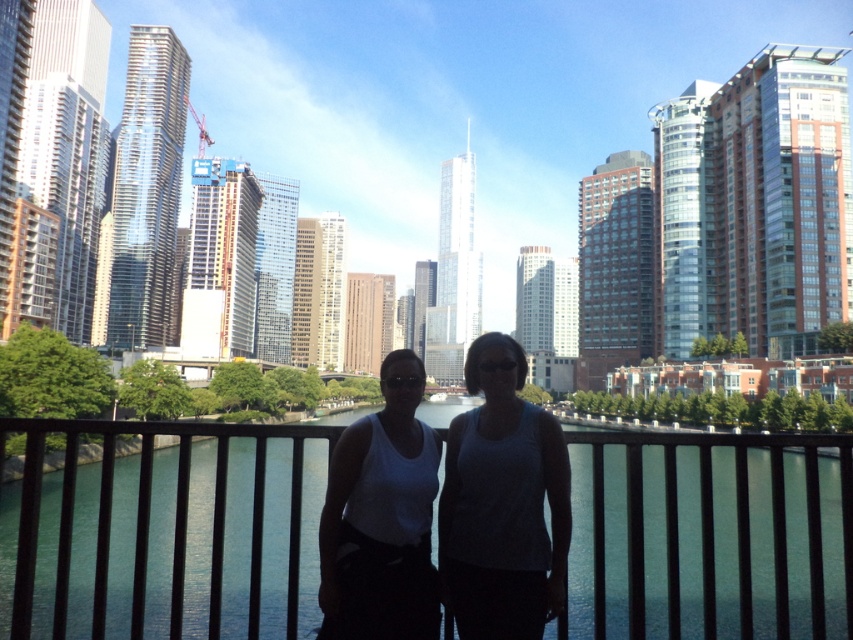
Is white fabric tank top at center wider than white matte tank top at center?

Yes.

You are a GUI agent. You are given a task and a screenshot of the screen. Output one action in this format:
    pyautogui.click(x=<x>, y=<y>)
    Task: Click on the white fabric tank top at center
    This screenshot has width=853, height=640.
    Given the screenshot: What is the action you would take?
    pyautogui.click(x=503, y=502)

Where is `white fabric tank top at center`? The width and height of the screenshot is (853, 640). white fabric tank top at center is located at coordinates (503, 502).

Is black metal fence at center bigger than white matte tank top at center?

Yes, black metal fence at center is bigger than white matte tank top at center.

Is black metal fence at center below white matte tank top at center?

Yes.

This screenshot has height=640, width=853. In order to click on black metal fence at center in this screenshot , I will do tap(166, 536).

Can you confirm if black metal fence at center is wider than white fabric tank top at center?

Yes.

Does point (149, 577) come behind point (483, 525)?

Yes, it is behind point (483, 525).

The image size is (853, 640). Find the location of `black metal fence at center`. black metal fence at center is located at coordinates (166, 536).